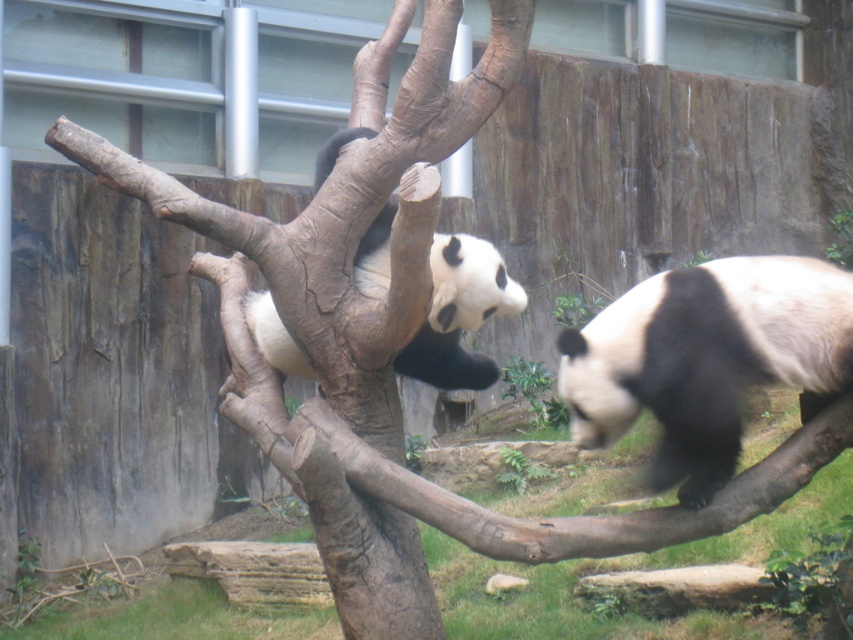
Question: Is black fuzzy panda at right bigger than black and white fur at upper center?

Choices:
 (A) no
 (B) yes

Answer: (B)

Question: Can you confirm if black fuzzy panda at right is positioned to the right of black and white fur at upper center?

Choices:
 (A) no
 (B) yes

Answer: (B)

Question: Which object appears farthest from the camera in this image?

Choices:
 (A) black and white fur at upper center
 (B) black fuzzy panda at right

Answer: (A)

Question: Where is black fuzzy panda at right located in relation to black and white fur at upper center in the image?

Choices:
 (A) below
 (B) above

Answer: (A)

Question: Which of the following is the closest to the observer?

Choices:
 (A) black fuzzy panda at right
 (B) black and white fur at upper center

Answer: (A)